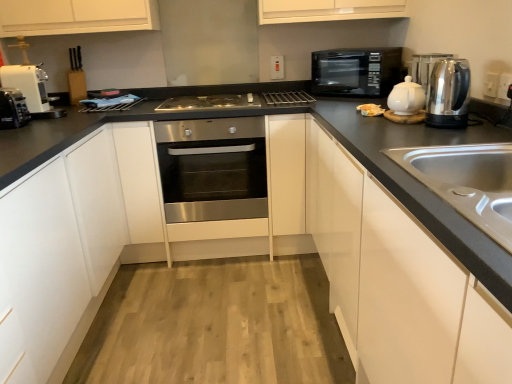
Question: In which direction should I rotate to look at white plastic electric outlet at upper center, which is the 2th electric outlet in bottom-to-top order?

Choices:
 (A) left
 (B) right

Answer: (B)

Question: Is white glossy cabinet at right, the 2th cabinetry viewed from the left, oriented away from white plastic coffee machine at left?

Choices:
 (A) yes
 (B) no

Answer: (B)

Question: From the image's perspective, would you say white glossy cabinet at right, the 2th cabinetry viewed from the left, is shown under white plastic coffee machine at left?

Choices:
 (A) yes
 (B) no

Answer: (A)

Question: Is white glossy cabinet at right, which is counted as the first cabinetry, starting from the right, thinner than white plastic coffee machine at left?

Choices:
 (A) yes
 (B) no

Answer: (B)

Question: Can you confirm if white glossy cabinet at right, the 2th cabinetry viewed from the left, is smaller than white plastic coffee machine at left?

Choices:
 (A) yes
 (B) no

Answer: (B)

Question: Is white glossy cabinet at right, the 2th cabinetry viewed from the left, oriented towards white plastic coffee machine at left?

Choices:
 (A) yes
 (B) no

Answer: (A)

Question: From a real-world perspective, is white glossy cabinet at right, which is counted as the first cabinetry, starting from the right, physically above white plastic coffee machine at left?

Choices:
 (A) no
 (B) yes

Answer: (A)

Question: Considering the relative sizes of stainless steel gas stove at center and brushed metal faucet at upper left in the image provided, is stainless steel gas stove at center smaller than brushed metal faucet at upper left?

Choices:
 (A) yes
 (B) no

Answer: (B)

Question: Would you consider stainless steel gas stove at center to be distant from brushed metal faucet at upper left?

Choices:
 (A) yes
 (B) no

Answer: (A)

Question: Is stainless steel gas stove at center further to camera compared to brushed metal faucet at upper left?

Choices:
 (A) yes
 (B) no

Answer: (A)

Question: From the image's perspective, would you say stainless steel gas stove at center is shown under brushed metal faucet at upper left?

Choices:
 (A) no
 (B) yes

Answer: (B)

Question: Can you confirm if stainless steel gas stove at center is taller than brushed metal faucet at upper left?

Choices:
 (A) yes
 (B) no

Answer: (B)

Question: From a real-world perspective, is stainless steel gas stove at center below brushed metal faucet at upper left?

Choices:
 (A) no
 (B) yes

Answer: (B)

Question: From a real-world perspective, is white plastic toaster at left over white plastic electric outlet at upper center, which appears as the second electric outlet when viewed from the right?

Choices:
 (A) yes
 (B) no

Answer: (B)